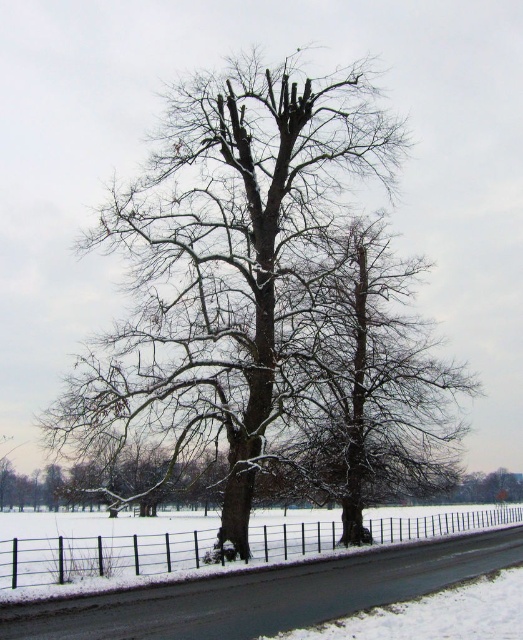
Question: Among these objects, which one is nearest to the camera?

Choices:
 (A) black metal fence at lower center
 (B) snow-covered tree at center

Answer: (A)

Question: Can you confirm if snow-covered tree at center is positioned below black metal fence at lower center?

Choices:
 (A) yes
 (B) no

Answer: (B)

Question: Is snow-covered tree at center thinner than black metal fence at lower center?

Choices:
 (A) yes
 (B) no

Answer: (A)

Question: Can you confirm if snow-covered tree at center is smaller than black metal fence at lower center?

Choices:
 (A) no
 (B) yes

Answer: (B)

Question: Which of the following is the closest to the observer?

Choices:
 (A) black metal fence at lower center
 (B) snow-covered tree at center

Answer: (A)